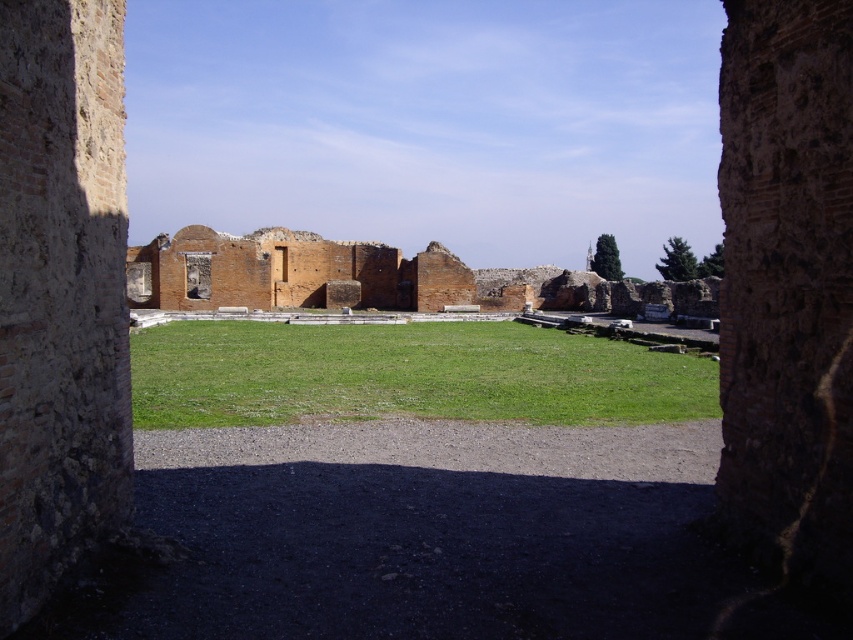
Is green grass at center positioned in front of brick wall ruins at center?

No, green grass at center is behind brick wall ruins at center.

At what (x,y) coordinates should I click in order to perform the action: click on green grass at center. Please return your answer as a coordinate pair (x, y). The width and height of the screenshot is (853, 640). Looking at the image, I should click on (405, 374).